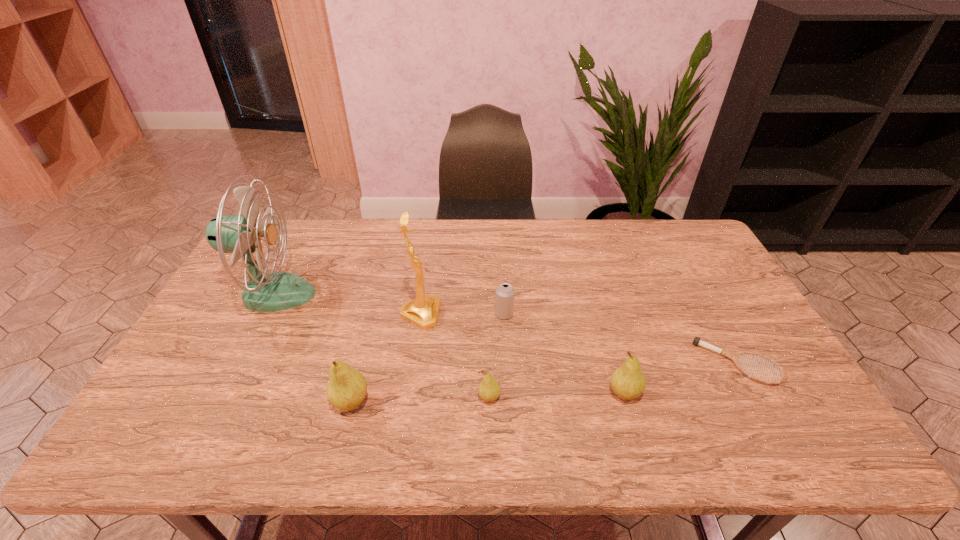
What are the coordinates of `empty location between the tennis racket and the second shortest pear` in the screenshot? It's located at (681, 379).

Identify the location of vacant area between the tennis racket and the second shortest pear. The height and width of the screenshot is (540, 960). pos(681,379).

Identify the location of vacant space in between the beer can and the second pear from left to right. The image size is (960, 540). (496, 356).

Choose which object is the fifth nearest neighbor to the beer can. Please provide its 2D coordinates. Your answer should be formatted as a tuple, i.e. [(x, y)], where the tuple contains the x and y coordinates of a point satisfying the conditions above.

[(733, 356)]

Choose which object is the sixth nearest neighbor to the second pear from right to left. Please provide its 2D coordinates. Your answer should be formatted as a tuple, i.e. [(x, y)], where the tuple contains the x and y coordinates of a point satisfying the conditions above.

[(265, 291)]

Locate an element on the screen. The height and width of the screenshot is (540, 960). pear identified as the third closest to the tennis racket is located at coordinates (346, 390).

Image resolution: width=960 pixels, height=540 pixels. I want to click on the closest pear relative to the fan, so click(346, 390).

Find the location of a particular element. The width and height of the screenshot is (960, 540). blank space that satisfies the following two spatial constraints: 1. on the back side of the sixth object from right to left; 2. on the left side of the beer can is located at coordinates (373, 314).

You are a GUI agent. You are given a task and a screenshot of the screen. Output one action in this format:
    pyautogui.click(x=<x>, y=<y>)
    Task: Click on the vacant point that satisfies the following two spatial constraints: 1. on the front-facing side of the award; 2. on the back side of the tennis racket
    
    Given the screenshot: What is the action you would take?
    pyautogui.click(x=414, y=363)

Where is `vacant region that satisfies the following two spatial constraints: 1. on the back side of the beer can; 2. in front of the fan, directing airflow`? vacant region that satisfies the following two spatial constraints: 1. on the back side of the beer can; 2. in front of the fan, directing airflow is located at coordinates (503, 294).